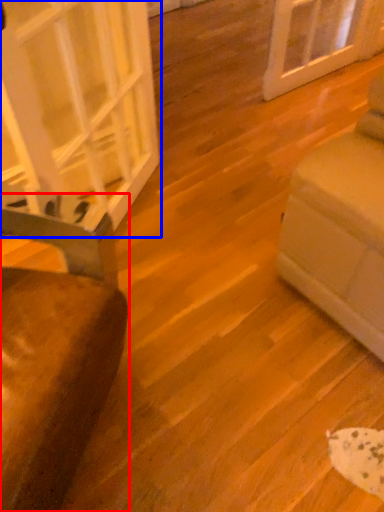
Question: Which of the following is the farthest to the observer, furniture (highlighted by a red box) or glass door (highlighted by a blue box)?

Choices:
 (A) furniture
 (B) glass door

Answer: (B)